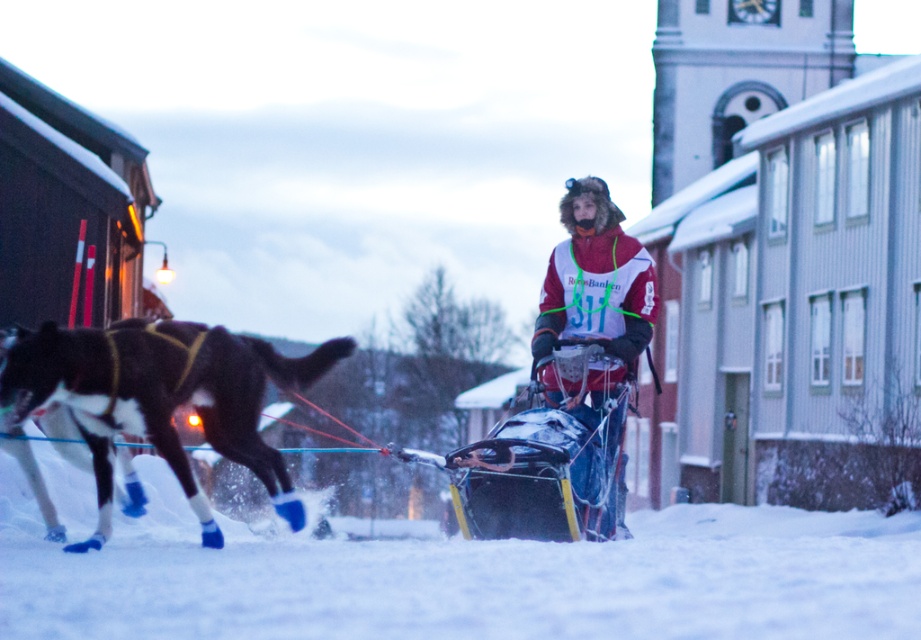
You are a photographer standing in the snow. You want to take a photo of the black fur dog at left and the white fluffy snow at lower center. Which object will appear larger in the photo?

The white fluffy snow at lower center is taller than the black fur dog at left, so it will appear larger in the photo.

From the picture: You are a photographer trying to capture the sled dogs in motion. You notice the white fluffy snow at lower center and the red and white jacket at center. Which object is taller in the image?

The white fluffy snow at lower center is taller than the red and white jacket at center.

You are a drone operator trying to capture the best aerial shot of the dog sled race. The drone is currently hovering at the center of the image. To get a clear view of the white fluffy snow at lower center, should you move the drone upwards or downwards?

The white fluffy snow at lower center is located at point [484,580] in 2D coordinates. Since the drone is at the center, which is point [460,320], the snow is below and to the right. To focus on it, move the drone downward and to the right. However, the question asks only upward or downward. Since the Y coordinate of the snow is 0.527, which is slightly below the center Y of 0.5, move the drone downward.